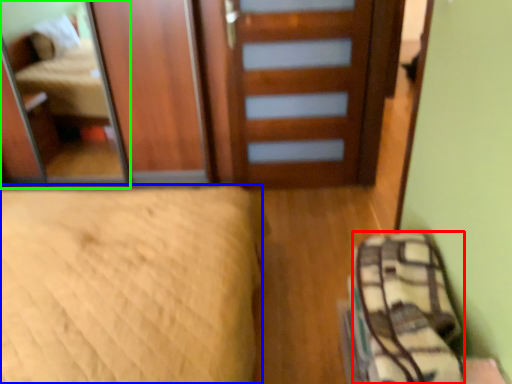
Question: Which object is the farthest from material (highlighted by a red box)? Choose among these: bed (highlighted by a blue box) or mirror (highlighted by a green box).

Choices:
 (A) bed
 (B) mirror

Answer: (B)